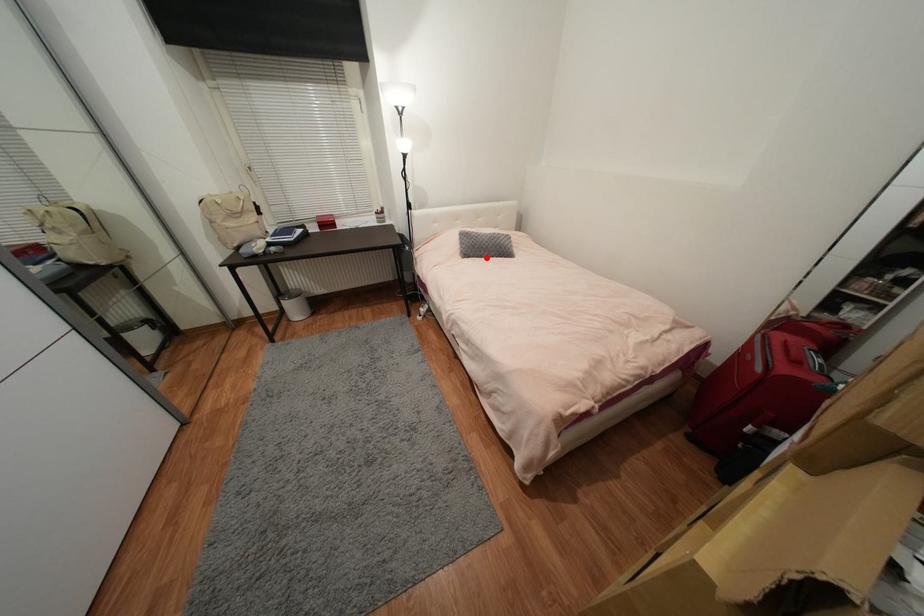
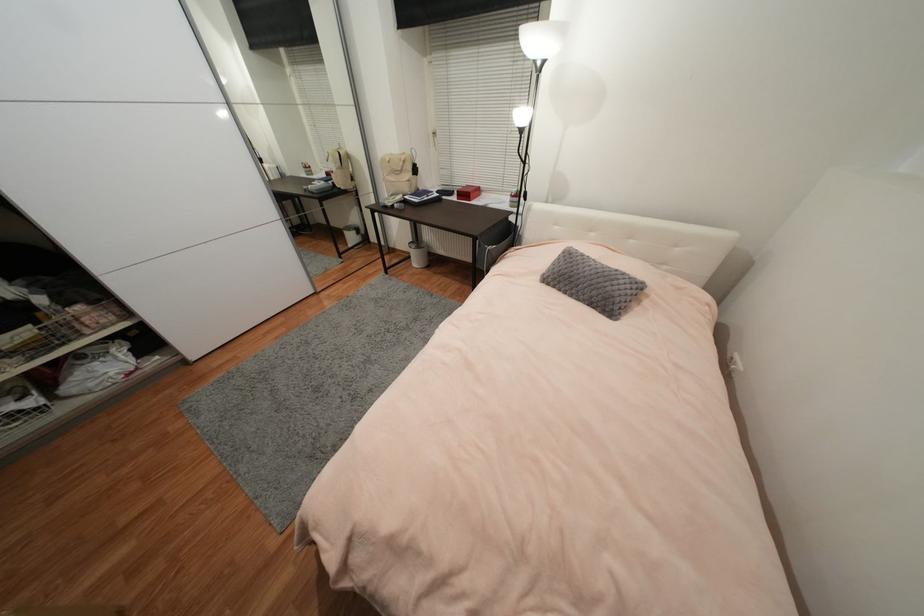
The point at the highlighted location is marked in the first image. Where is the corresponding point in the second image?

(569, 294)